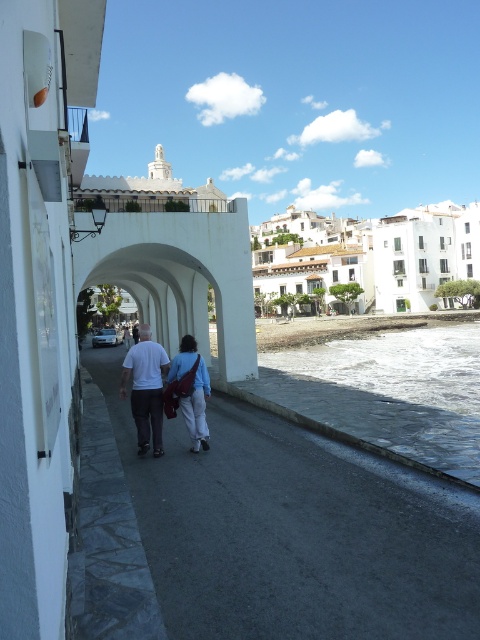
Does white matte bridge at center appear under white matte shirt at center?

Actually, white matte bridge at center is above white matte shirt at center.

Who is positioned more to the left, white matte bridge at center or white matte shirt at center?

white matte bridge at center is more to the left.

This screenshot has height=640, width=480. What do you see at coordinates (180, 276) in the screenshot?
I see `white matte bridge at center` at bounding box center [180, 276].

Locate an element on the screen. This screenshot has width=480, height=640. white matte bridge at center is located at coordinates (180, 276).

Looking at this image, is gray concrete pavement at center below white matte bridge at center?

Correct, gray concrete pavement at center is located below white matte bridge at center.

Is point (201, 556) in front of point (196, 336)?

Yes, point (201, 556) is in front of point (196, 336).

Where is `gray concrete pavement at center`? The height and width of the screenshot is (640, 480). gray concrete pavement at center is located at coordinates (294, 531).

From the picture: Is white matte bridge at center positioned before blue fabric bag at center?

No, it is not.

Is point (237, 288) positioned behind point (188, 408)?

Yes, it is behind point (188, 408).

You are a GUI agent. You are given a task and a screenshot of the screen. Output one action in this format:
    pyautogui.click(x=<x>, y=<y>)
    Task: Click on the white matte bridge at center
    Image resolution: width=480 pixels, height=640 pixels.
    Given the screenshot: What is the action you would take?
    pyautogui.click(x=180, y=276)